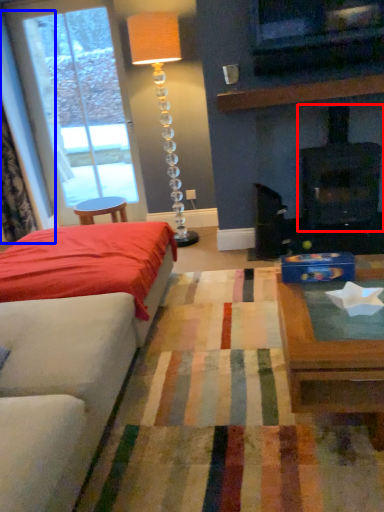
Question: Which point is further to the camera, fireplace (highlighted by a red box) or curtain (highlighted by a blue box)?

Choices:
 (A) fireplace
 (B) curtain

Answer: (B)